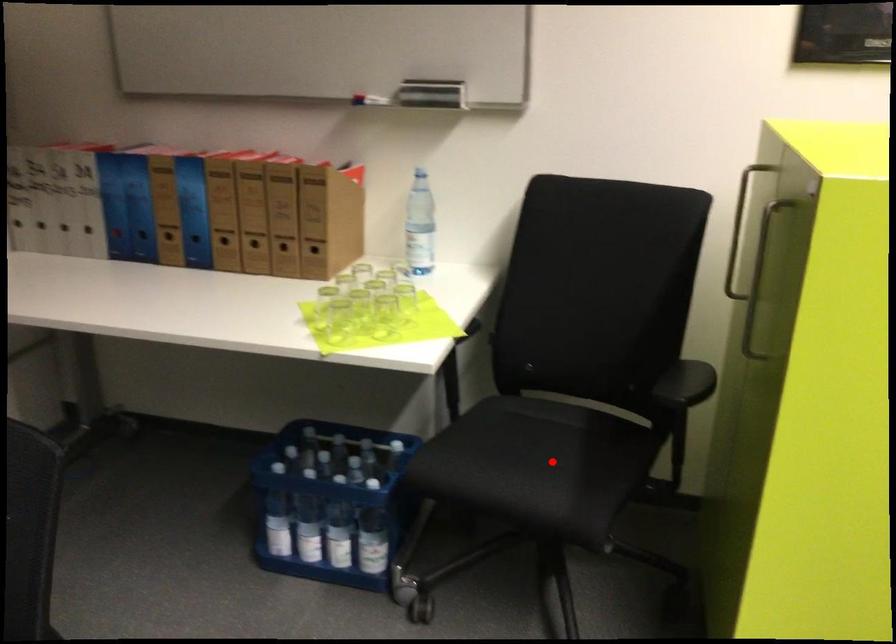
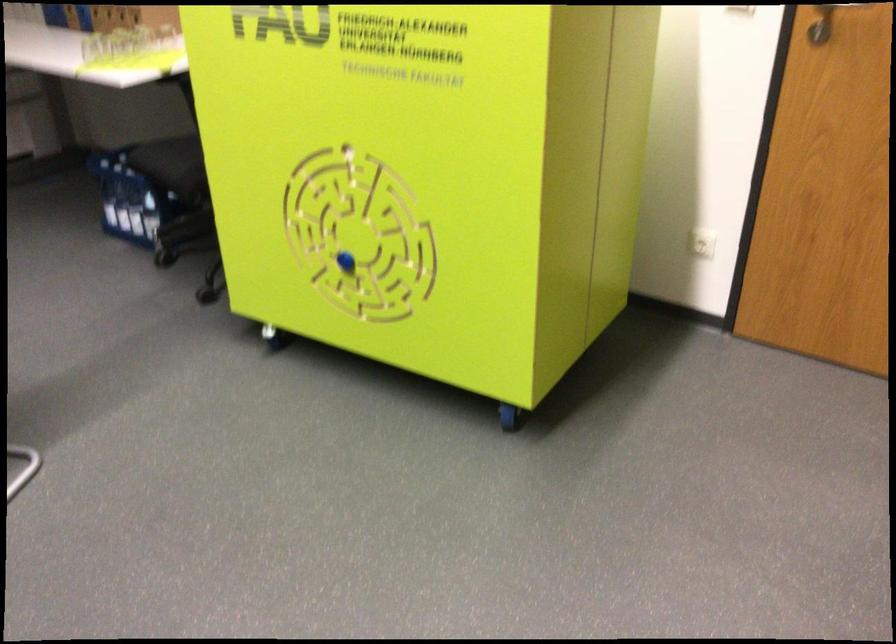
Question: I am providing you with two images of the same scene from different viewpoints. A red point is marked on the first image. Can you still see the location of the red point in image 2?

Choices:
 (A) Yes
 (B) No

Answer: (B)